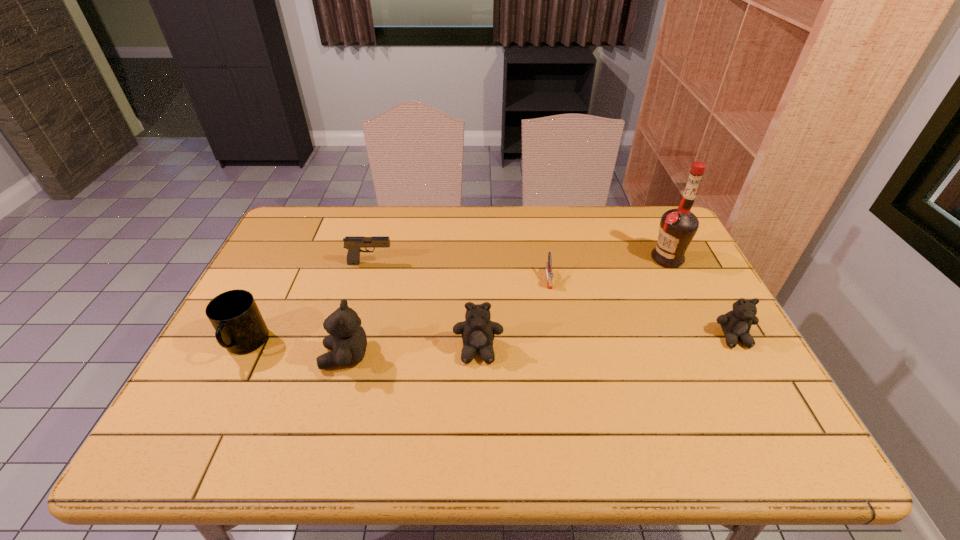
Identify the location of free region located on the face of the leftmost teddy bear. This screenshot has width=960, height=540. click(216, 357).

Where is `free space located 0.140m on the face of the leftmost teddy bear`? The width and height of the screenshot is (960, 540). free space located 0.140m on the face of the leftmost teddy bear is located at coordinates (265, 357).

Where is `free space located on the face of the fourth object from right to left`? free space located on the face of the fourth object from right to left is located at coordinates (478, 392).

Where is `vacant space located 0.050m on the face of the shortest teddy bear`? This screenshot has height=540, width=960. vacant space located 0.050m on the face of the shortest teddy bear is located at coordinates (750, 367).

Find the location of a particular element. blank space located aim along the barrel of the pistol is located at coordinates coord(462,263).

You are a GUI agent. You are given a task and a screenshot of the screen. Output one action in this format:
    pyautogui.click(x=<x>, y=<y>)
    Task: Click on the free space located 0.230m on the handle side of the shortest object
    
    Given the screenshot: What is the action you would take?
    pyautogui.click(x=561, y=353)

Where is `vacant point located on the front and back of the tallest object`? vacant point located on the front and back of the tallest object is located at coordinates (599, 258).

Identify the location of vacant space located 0.400m on the front and back of the tallest object. (522, 258).

At what (x,y) coordinates should I click in order to perform the action: click on vacant space positioned on the front and back of the tallest object. Please return your answer as a coordinate pair (x, y). The width and height of the screenshot is (960, 540). Looking at the image, I should click on (609, 258).

Locate an element on the screen. This screenshot has width=960, height=540. free point located 0.050m on the side of the leftmost object with the handle is located at coordinates (226, 384).